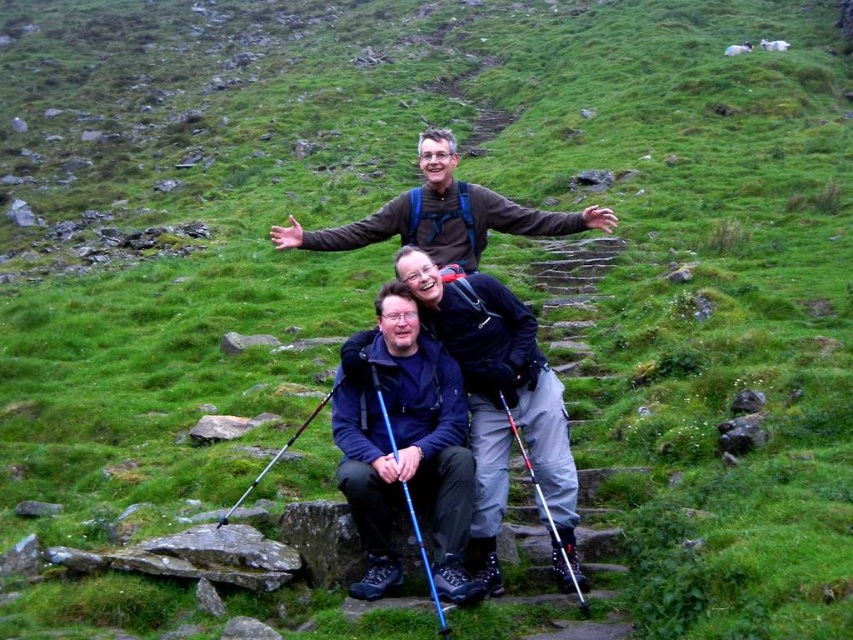
Question: Which point appears farthest from the camera in this image?

Choices:
 (A) (548, 392)
 (B) (585, 218)

Answer: (B)

Question: In this image, where is dark blue fabric jacket at center located relative to brown fabric jacket at center?

Choices:
 (A) below
 (B) above

Answer: (A)

Question: In this image, where is dark blue fabric jacket at center located relative to brown fabric jacket at center?

Choices:
 (A) left
 (B) right

Answer: (B)

Question: Does dark blue fabric jacket at center appear over brown fabric jacket at center?

Choices:
 (A) no
 (B) yes

Answer: (A)